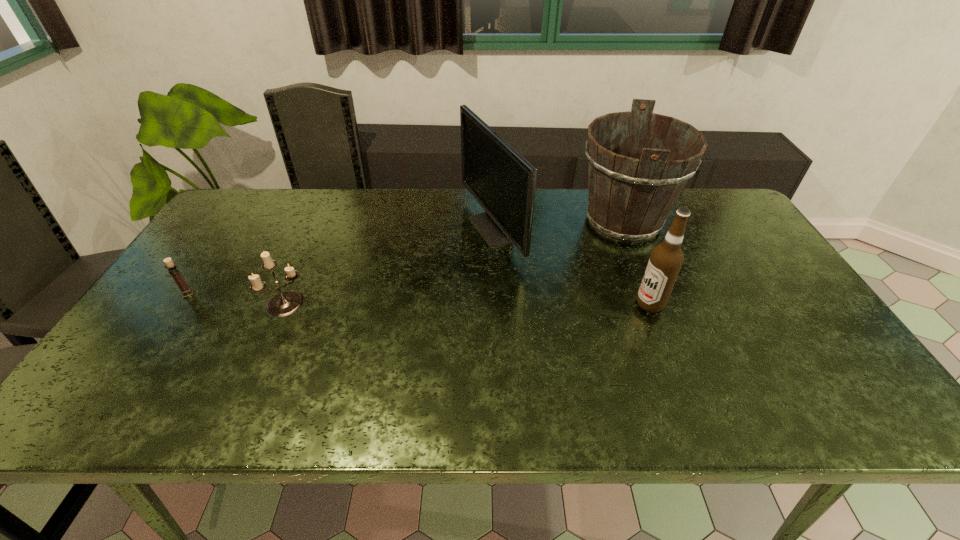
In the image, there is a desktop. At what (x,y) coordinates should I click in order to perform the action: click on vacant space at the left edge. Please return your answer as a coordinate pair (x, y). This screenshot has height=540, width=960. Looking at the image, I should click on click(x=219, y=248).

Identify the location of vacant space at the right edge of the desktop. (778, 316).

Where is `vacant space at the far left corner`? The height and width of the screenshot is (540, 960). vacant space at the far left corner is located at coordinates (253, 211).

Where is `vacant space at the far right corner of the desktop`? vacant space at the far right corner of the desktop is located at coordinates (720, 217).

Find the location of a particular element. vacant space that is in between the third object from left to right and the alcohol is located at coordinates (571, 267).

Where is `blank region between the right candle holder and the bucket`? blank region between the right candle holder and the bucket is located at coordinates (456, 262).

Identify the location of free space between the shorter candle holder and the fourth object from right to left. This screenshot has width=960, height=540. (238, 299).

Image resolution: width=960 pixels, height=540 pixels. I want to click on empty space that is in between the shortest object and the third object from left to right, so click(340, 261).

The image size is (960, 540). Identify the location of empty space between the left candle holder and the right candle holder. (238, 299).

The image size is (960, 540). Identify the location of vacant region between the bucket and the second object from left to right. (456, 262).